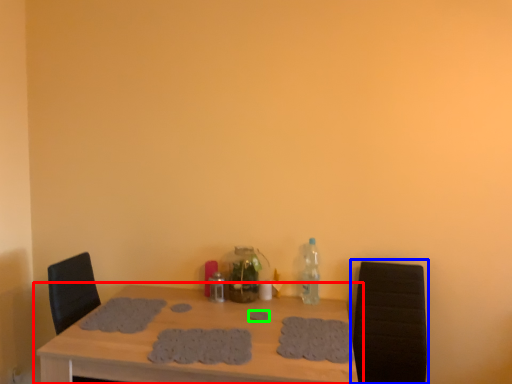
Question: Which object is positioned farthest from table (highlighted by a red box)? Select from armchair (highlighted by a blue box) and footprint (highlighted by a green box).

Choices:
 (A) armchair
 (B) footprint

Answer: (A)